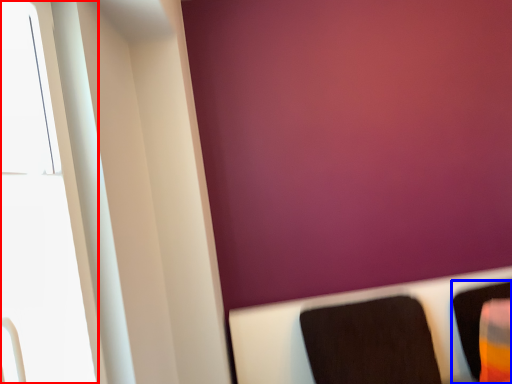
Question: Which object appears farthest to the camera in this image, window (highlighted by a red box) or furniture (highlighted by a blue box)?

Choices:
 (A) window
 (B) furniture

Answer: (B)